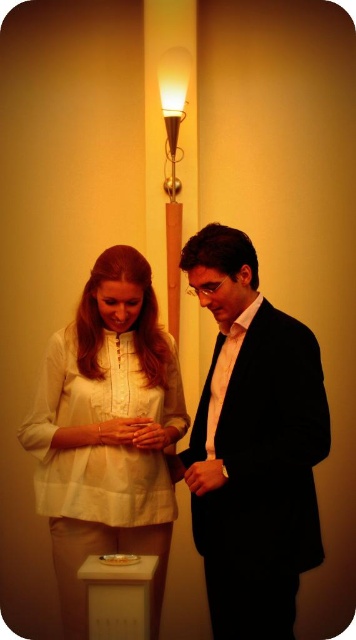
Question: Estimate the real-world distances between objects in this image. Which object is farther from the matte white blouse at center?

Choices:
 (A) matte gold lamp at upper center
 (B) black satin suit at center

Answer: (A)

Question: Is matte white blouse at center wider than matte gold lamp at upper center?

Choices:
 (A) no
 (B) yes

Answer: (B)

Question: Is matte white blouse at center closer to camera compared to matte gold lamp at upper center?

Choices:
 (A) yes
 (B) no

Answer: (A)

Question: Based on their relative distances, which object is farther from the matte white blouse at center?

Choices:
 (A) matte gold lamp at upper center
 (B) black satin suit at center

Answer: (A)

Question: Which of the following is the closest to the observer?

Choices:
 (A) matte gold lamp at upper center
 (B) black satin suit at center

Answer: (B)

Question: Can you confirm if matte white blouse at center is bigger than matte gold lamp at upper center?

Choices:
 (A) no
 (B) yes

Answer: (B)